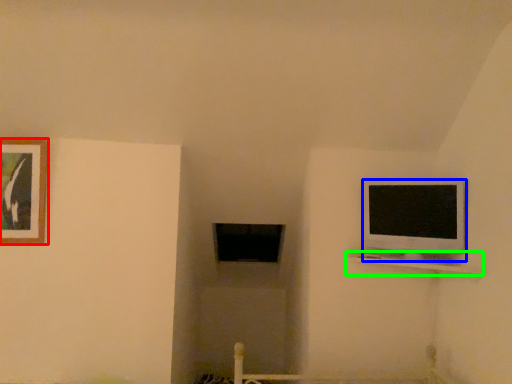
Question: Which object is the farthest from picture frame (highlighted by a red box)? Choose among these: television (highlighted by a blue box) or shelf (highlighted by a green box).

Choices:
 (A) television
 (B) shelf

Answer: (A)